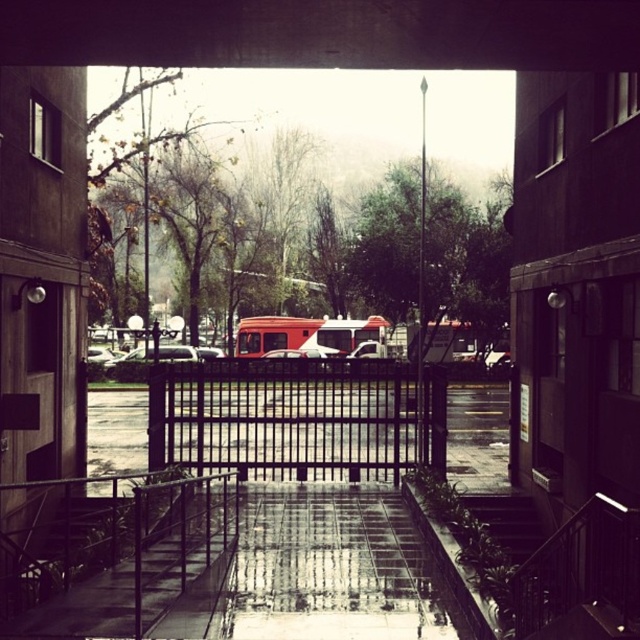
Does metal/rusty fence at center have a larger size compared to black metal fence at center?

No, metal/rusty fence at center is not bigger than black metal fence at center.

Which of these two, metal/rusty fence at center or black metal fence at center, stands shorter?

With less height is metal/rusty fence at center.

Locate an element on the screen. metal/rusty fence at center is located at coordinates (108, 548).

Is concrete at center further to the viewer compared to black metal fence at center?

That is False.

From the picture: Which of these two, concrete at center or black metal fence at center, stands shorter?

With less height is concrete at center.

Identify the location of concrete at center. (323, 33).

Is concrete at center taller than metal/rusty fence at center?

No.

Which is in front, point (474, 68) or point (112, 564)?

Positioned in front is point (474, 68).

Where is `concrete at center`? concrete at center is located at coordinates (323, 33).